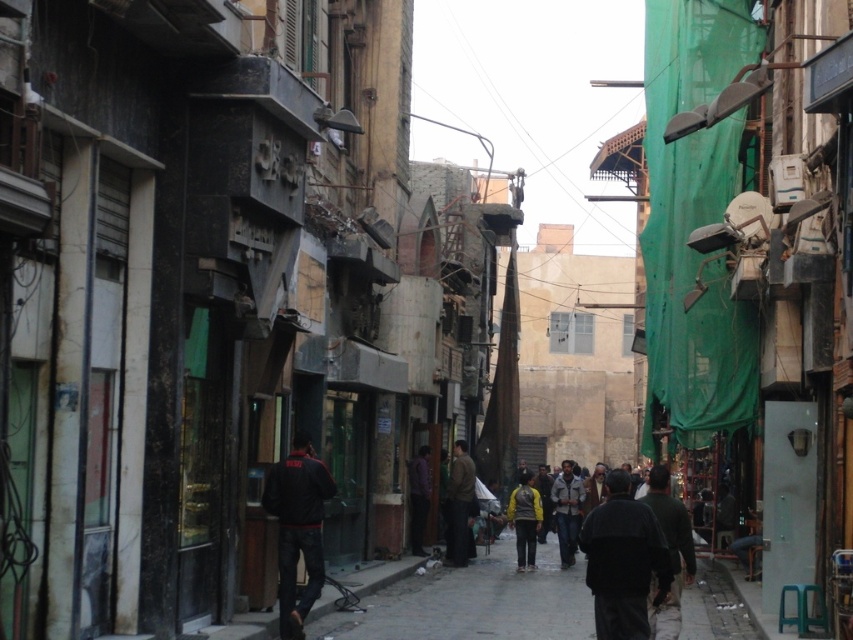
Question: Does black fabric jacket at center appear over purple matte shirt at center?

Choices:
 (A) yes
 (B) no

Answer: (A)

Question: Is gray concrete pavement at center above dark brown leather jacket at center?

Choices:
 (A) no
 (B) yes

Answer: (A)

Question: Which point is closer to the camera taking this photo?

Choices:
 (A) (650, 624)
 (B) (524, 529)
 (C) (730, 621)
 (D) (305, 561)

Answer: (A)

Question: Which point appears farthest from the camera in this image?

Choices:
 (A) (672, 620)
 (B) (311, 563)
 (C) (560, 529)

Answer: (C)

Question: Which object is the closest to the dark brown leather jacket at center?

Choices:
 (A) yellow-green jacket at center
 (B) dark green fabric at center
 (C) black fabric jacket at center

Answer: (A)

Question: Is gray concrete pavement at center smaller than dark gray sweater at center?

Choices:
 (A) yes
 (B) no

Answer: (B)